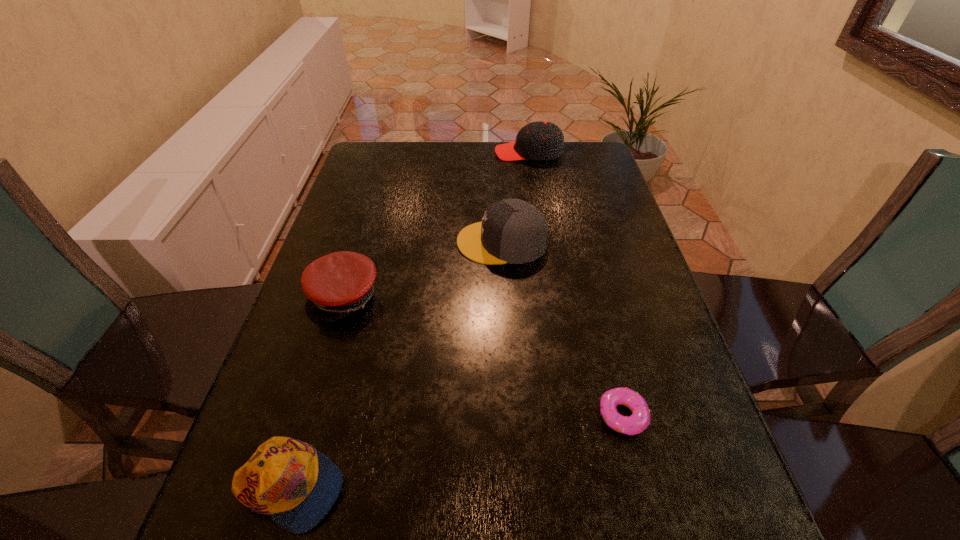
Image resolution: width=960 pixels, height=540 pixels. I want to click on vacant space that satisfies the following two spatial constraints: 1. on the front-facing side of the farthest object; 2. on the back side of the shortest object, so click(x=570, y=415).

The height and width of the screenshot is (540, 960). What are the coordinates of `vacant space that satisfies the following two spatial constraints: 1. on the front-facing side of the farthest cap; 2. at the front of the third farthest object where the visor is located` in the screenshot? It's located at (552, 296).